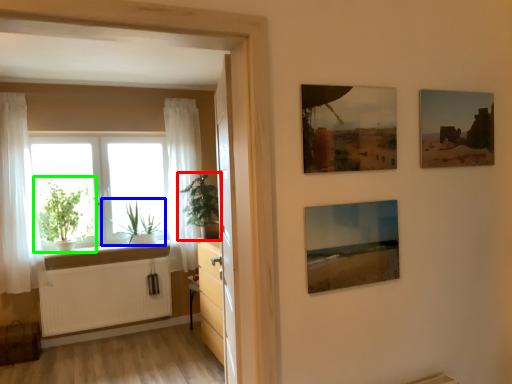
Question: Which is farther away from houseplant (highlighted by a red box)? plant (highlighted by a blue box) or houseplant (highlighted by a green box)?

Choices:
 (A) plant
 (B) houseplant

Answer: (B)